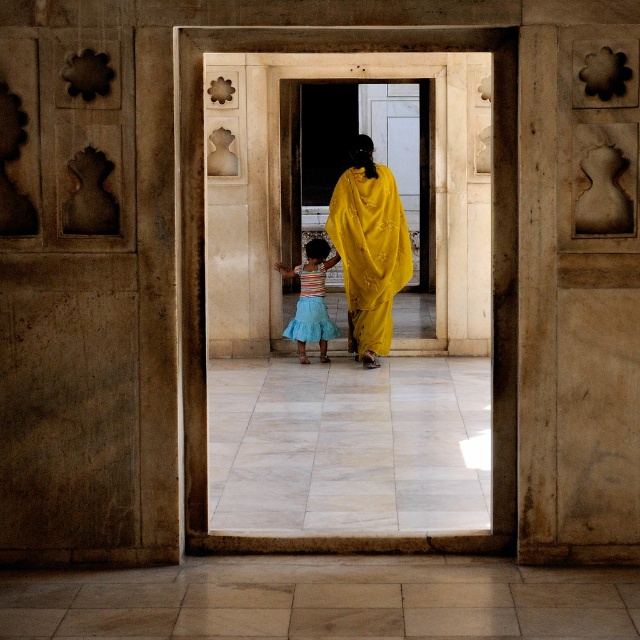
Question: Is yellow satin sari at center smaller than blue tulle skirt at center?

Choices:
 (A) no
 (B) yes

Answer: (A)

Question: Is yellow satin sari at center smaller than blue tulle skirt at center?

Choices:
 (A) yes
 (B) no

Answer: (B)

Question: Which object appears farthest from the camera in this image?

Choices:
 (A) blue tulle skirt at center
 (B) yellow satin sari at center

Answer: (A)

Question: Does yellow satin sari at center have a greater width compared to blue tulle skirt at center?

Choices:
 (A) no
 (B) yes

Answer: (B)